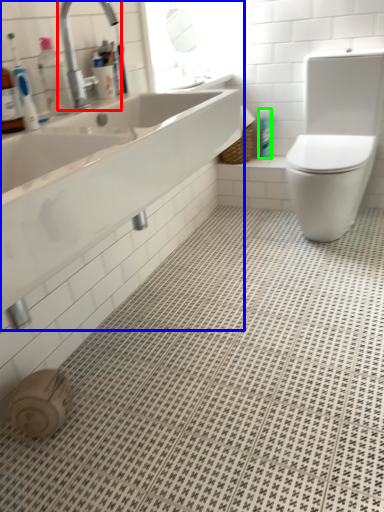
Question: Which object is the farthest from tap (highlighted by a red box)? Choose among these: sink (highlighted by a blue box) or toiletry (highlighted by a green box).

Choices:
 (A) sink
 (B) toiletry

Answer: (B)